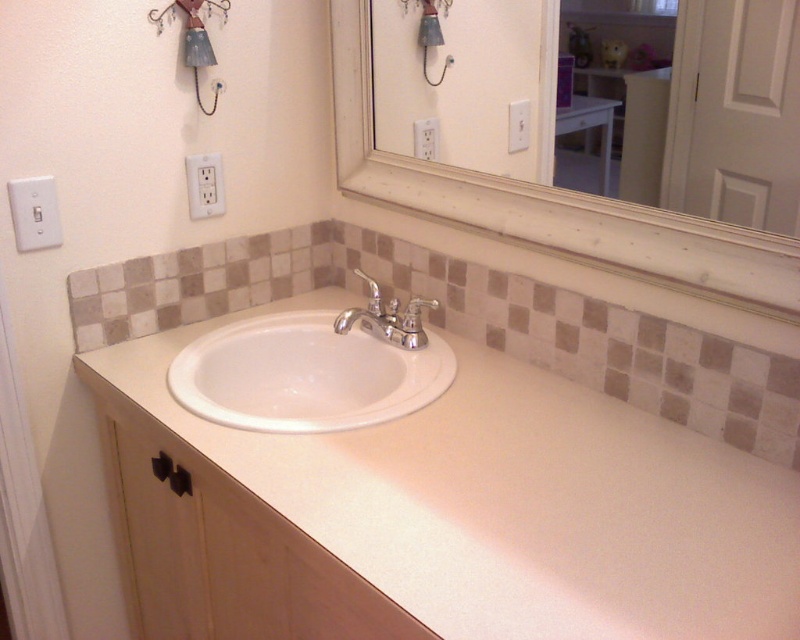
In the scene shown: You are a delivery person trying to install a new medicine cabinet. The cabinet requires two mounting points located at point (289, 355) and point (436, 304). According to the image, which mounting point is positioned further back from the front of the vanity area?

Point (289, 355) is behind point (436, 304), so the mounting point at point (289, 355) is positioned further back from the front of the vanity area.